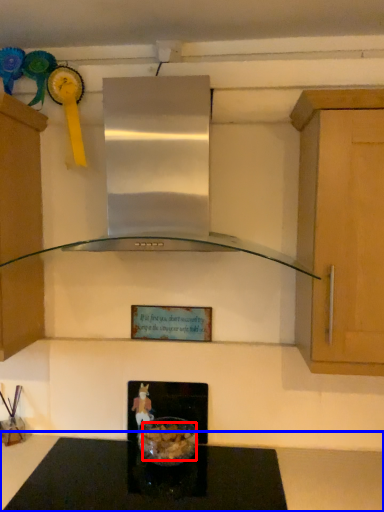
Question: Which point is further to the camera, food (highlighted by a red box) or countertop (highlighted by a blue box)?

Choices:
 (A) food
 (B) countertop

Answer: (A)